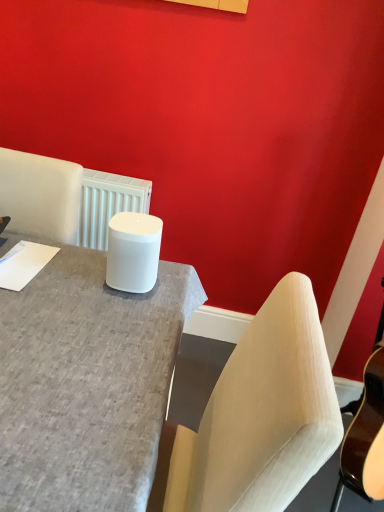
This screenshot has width=384, height=512. Describe the element at coordinates (86, 384) in the screenshot. I see `matte gray desk at center` at that location.

What is the approximate height of matte gray desk at center?

matte gray desk at center is 37.61 inches tall.

Locate an element on the screen. The image size is (384, 512). matte gray desk at center is located at coordinates (86, 384).

Image resolution: width=384 pixels, height=512 pixels. What do you see at coordinates (133, 252) in the screenshot?
I see `white matte cylinder at center` at bounding box center [133, 252].

Locate an element on the screen. This screenshot has height=512, width=384. white matte cylinder at center is located at coordinates (x=133, y=252).

Find the location of `matte gray desk at center`. matte gray desk at center is located at coordinates (86, 384).

Visually, is matte gray desk at center positioned to the left or to the right of white matte cylinder at center?

In the image, matte gray desk at center appears on the right side of white matte cylinder at center.

Considering the relative positions of matte gray desk at center and white matte cylinder at center in the image provided, is matte gray desk at center in front of white matte cylinder at center?

Yes.

Which point is more distant from viewer, (2,389) or (145,271)?

The point (145,271) is more distant.

From the image's perspective, would you say matte gray desk at center is positioned over white matte cylinder at center?

Incorrect, from the image's perspective, matte gray desk at center is lower than white matte cylinder at center.

In the scene shown: From a real-world perspective, is matte gray desk at center physically located above or below white matte cylinder at center?

Clearly, from a real-world perspective, matte gray desk at center is below white matte cylinder at center.

Which of these two, matte gray desk at center or white matte cylinder at center, is wider?

With larger width is matte gray desk at center.

Which of these two, matte gray desk at center or white matte cylinder at center, stands shorter?

Standing shorter between the two is white matte cylinder at center.

Does matte gray desk at center have a larger size compared to white matte cylinder at center?

Correct, matte gray desk at center is larger in size than white matte cylinder at center.

Is matte gray desk at center spatially inside white matte cylinder at center, or outside of it?

matte gray desk at center is not enclosed by white matte cylinder at center.

Is matte gray desk at center next to white matte cylinder at center and touching it?

No.

Is matte gray desk at center looking in the opposite direction of white matte cylinder at center?

No, matte gray desk at center is not facing away from white matte cylinder at center.

How far apart are matte gray desk at center and white matte cylinder at center?

matte gray desk at center is 7.45 inches from white matte cylinder at center.

I want to click on desk in front of the white matte cylinder at center, so click(86, 384).

Consider the image. Is white matte cylinder at center to the left of matte gray desk at center from the viewer's perspective?

Yes, white matte cylinder at center is to the left of matte gray desk at center.

Between white matte cylinder at center and matte gray desk at center, which one is positioned in front?

matte gray desk at center.

Which is in front, point (138, 269) or point (172, 280)?

The point (138, 269) is more forward.

From the image's perspective, between white matte cylinder at center and matte gray desk at center, who is located below?

matte gray desk at center is shown below in the image.

From a real-world perspective, does white matte cylinder at center sit lower than matte gray desk at center?

No, from a real-world perspective, white matte cylinder at center is not beneath matte gray desk at center.

Considering the relative sizes of white matte cylinder at center and matte gray desk at center in the image provided, is white matte cylinder at center thinner than matte gray desk at center?

Yes.

Considering the sizes of objects white matte cylinder at center and matte gray desk at center in the image provided, who is taller, white matte cylinder at center or matte gray desk at center?

With more height is matte gray desk at center.

Is white matte cylinder at center smaller than matte gray desk at center?

Correct, white matte cylinder at center occupies less space than matte gray desk at center.

Would you say white matte cylinder at center contains matte gray desk at center?

Actually, matte gray desk at center is outside white matte cylinder at center.

Is white matte cylinder at center far from matte gray desk at center?

Actually, white matte cylinder at center and matte gray desk at center are a little close together.

Is white matte cylinder at center oriented away from matte gray desk at center?

No.

At what (x,y) coordinates should I click in order to perform the action: click on candle holder positioned vertically above the matte gray desk at center (from a real-world perspective). Please return your answer as a coordinate pair (x, y). This screenshot has width=384, height=512. Looking at the image, I should click on (133, 252).

Where is `desk below the white matte cylinder at center (from the image's perspective)`? The height and width of the screenshot is (512, 384). desk below the white matte cylinder at center (from the image's perspective) is located at coordinates (86, 384).

Where is `candle holder above the matte gray desk at center (from a real-world perspective)`? Image resolution: width=384 pixels, height=512 pixels. candle holder above the matte gray desk at center (from a real-world perspective) is located at coordinates (133, 252).